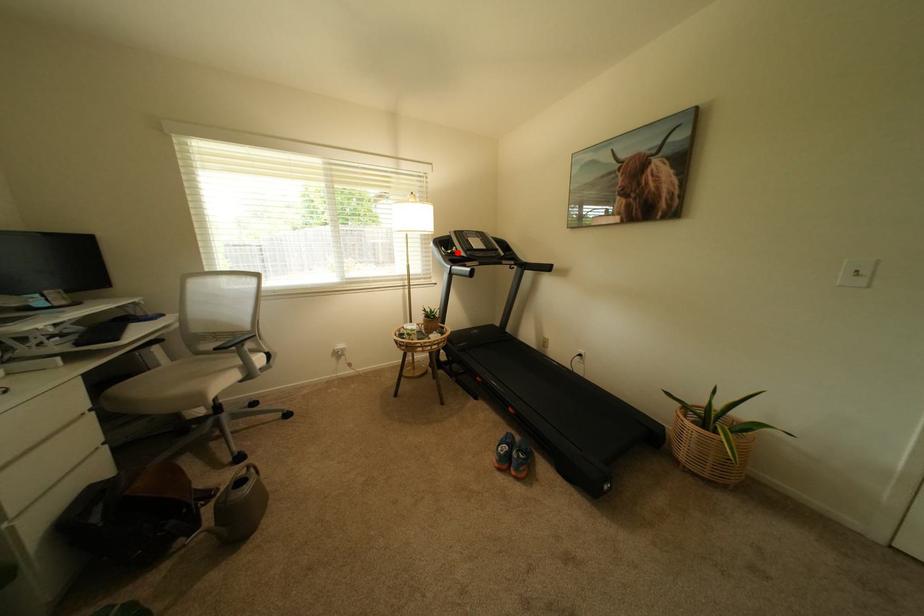
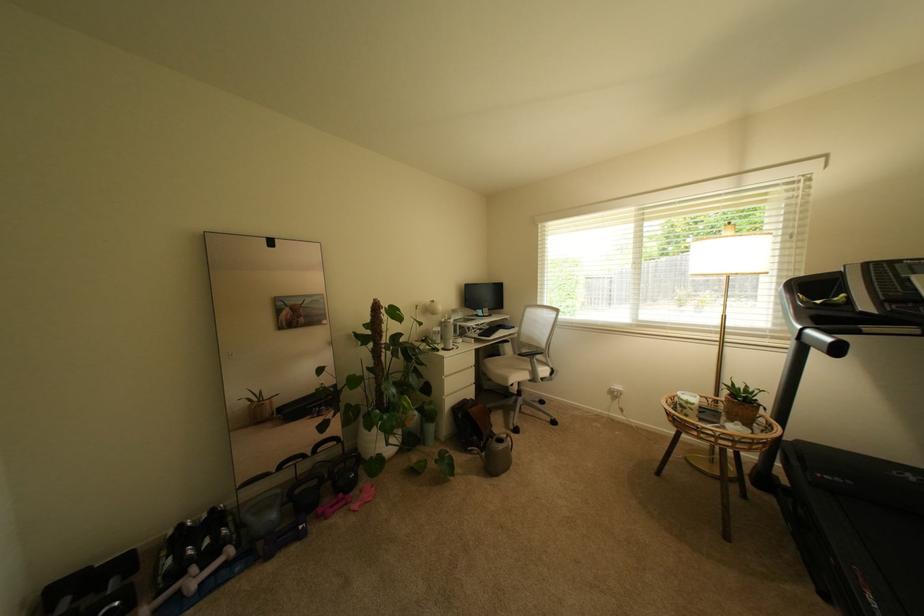
Question: I am providing you with two images of the same scene from different viewpoints. A red point is marked on the first image. Is the red point's position out of view in image 2?

Choices:
 (A) Yes
 (B) No

Answer: (B)